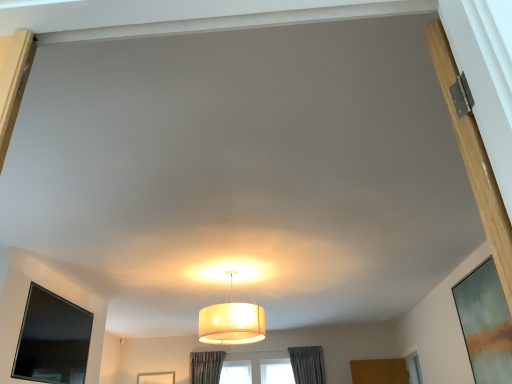
Question: Does black glossy tv at lower left, the first window screen when ordered from left to right, have a greater height compared to matte white lampshade at center?

Choices:
 (A) no
 (B) yes

Answer: (B)

Question: Does black glossy tv at lower left, which is the second window screen in right-to-left order, have a smaller size compared to matte white lampshade at center?

Choices:
 (A) no
 (B) yes

Answer: (B)

Question: From the image's perspective, is black glossy tv at lower left, the first window screen when ordered from left to right, beneath matte white lampshade at center?

Choices:
 (A) no
 (B) yes

Answer: (B)

Question: Is black glossy tv at lower left, the first window screen when ordered from left to right, to the left of matte white lampshade at center from the viewer's perspective?

Choices:
 (A) no
 (B) yes

Answer: (B)

Question: From a real-world perspective, is black glossy tv at lower left, the first window screen when ordered from left to right, on matte white lampshade at center?

Choices:
 (A) no
 (B) yes

Answer: (A)

Question: From a real-world perspective, is black glossy tv at lower left, the first window screen when ordered from left to right, located beneath matte white lampshade at center?

Choices:
 (A) yes
 (B) no

Answer: (A)

Question: Is matte glass window screen at right, the first window screen viewed from the right, to the right of black glossy tv at lower left, which is the second window screen in right-to-left order, from the viewer's perspective?

Choices:
 (A) no
 (B) yes

Answer: (B)

Question: Considering the relative positions of matte glass window screen at right, the first window screen viewed from the right, and black glossy tv at lower left, which is the second window screen in right-to-left order, in the image provided, is matte glass window screen at right, the first window screen viewed from the right, to the left of black glossy tv at lower left, which is the second window screen in right-to-left order, from the viewer's perspective?

Choices:
 (A) yes
 (B) no

Answer: (B)

Question: From a real-world perspective, is matte glass window screen at right, arranged as the second window screen when viewed from the left, physically above black glossy tv at lower left, which is the second window screen in right-to-left order?

Choices:
 (A) yes
 (B) no

Answer: (B)

Question: From the image's perspective, is matte glass window screen at right, the first window screen viewed from the right, beneath black glossy tv at lower left, the first window screen when ordered from left to right?

Choices:
 (A) yes
 (B) no

Answer: (B)

Question: Does matte glass window screen at right, the first window screen viewed from the right, have a larger size compared to black glossy tv at lower left, the first window screen when ordered from left to right?

Choices:
 (A) yes
 (B) no

Answer: (A)

Question: Does matte glass window screen at right, arranged as the second window screen when viewed from the left, have a greater height compared to black glossy tv at lower left, the first window screen when ordered from left to right?

Choices:
 (A) no
 (B) yes

Answer: (B)

Question: Is matte white lampshade at center next to matte glass window screen at right, arranged as the second window screen when viewed from the left?

Choices:
 (A) yes
 (B) no

Answer: (B)